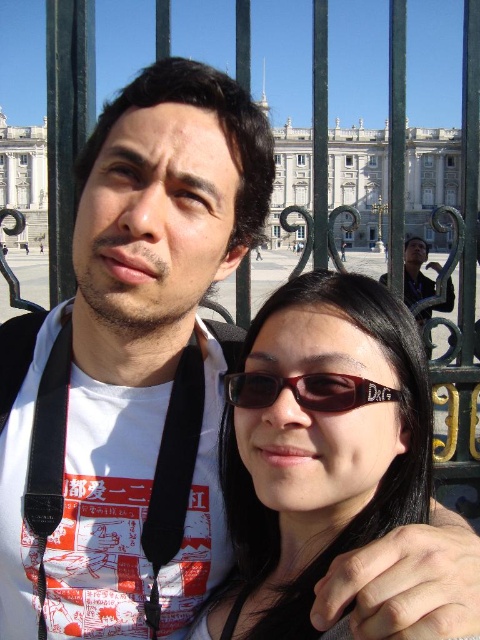
Does black plastic sunglasses at center have a greater height compared to brown matte sunglasses at center?

Correct, black plastic sunglasses at center is much taller as brown matte sunglasses at center.

Which of these two, black plastic sunglasses at center or brown matte sunglasses at center, stands taller?

black plastic sunglasses at center is taller.

Which is in front, point (375, 464) or point (338, 403)?

Point (338, 403) is in front.

The image size is (480, 640). Find the location of `black plastic sunglasses at center`. black plastic sunglasses at center is located at coordinates (317, 445).